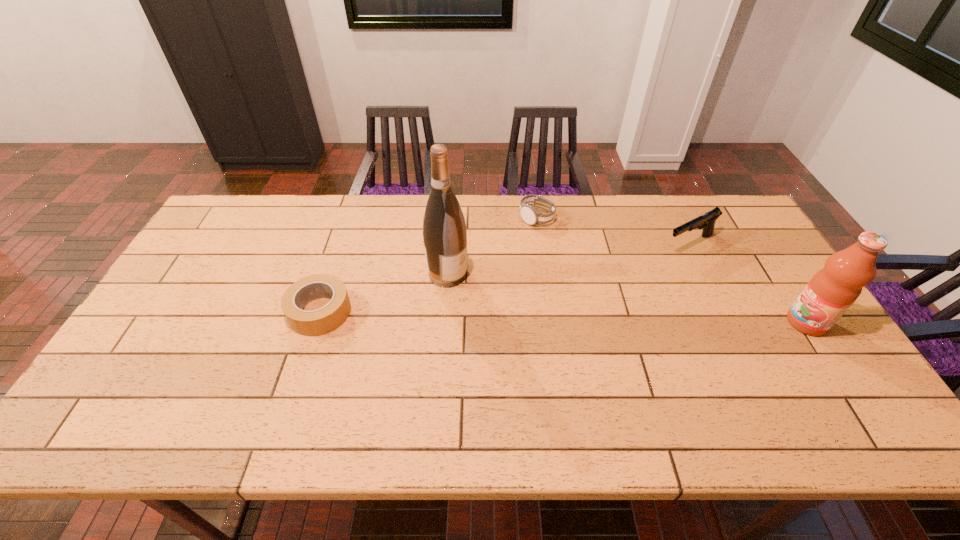
Identify the location of vacant space on the desktop that is between the shortest object and the second tallest object and is positioned on the label of the tallest object. (525, 316).

Where is `free spot on the desktop that is between the shortest object and the rightmost object and is positioned on the face of the watch`? free spot on the desktop that is between the shortest object and the rightmost object and is positioned on the face of the watch is located at coordinates (576, 318).

The image size is (960, 540). In order to click on free space on the desktop that is between the shortest object and the rightmost object and is positioned at the aiming end of the gun in this screenshot , I will do `click(549, 317)`.